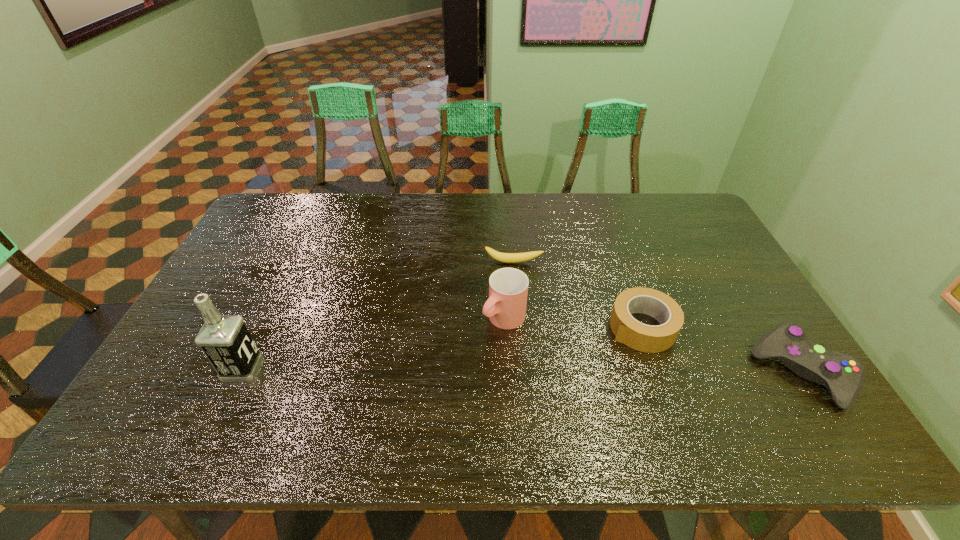
In order to click on object that is at the left edge in this screenshot , I will do `click(225, 340)`.

In order to click on object present at the right edge in this screenshot , I will do `click(843, 374)`.

You are a GUI agent. You are given a task and a screenshot of the screen. Output one action in this format:
    pyautogui.click(x=<x>, y=<y>)
    Task: Click on the object present at the near left corner
    
    Given the screenshot: What is the action you would take?
    pos(225,340)

Image resolution: width=960 pixels, height=540 pixels. Identify the location of object present at the near right corner. (843, 374).

This screenshot has height=540, width=960. Find the location of `free region at the far edge`. free region at the far edge is located at coordinates (528, 217).

Find the location of a particular element. The width and height of the screenshot is (960, 540). vacant area at the near edge of the desktop is located at coordinates click(499, 397).

Image resolution: width=960 pixels, height=540 pixels. Find the location of `vacant area at the left edge`. vacant area at the left edge is located at coordinates (235, 294).

Find the location of a particular element. free spot at the right edge of the desktop is located at coordinates (748, 322).

Locate an element on the screen. free region at the far right corner of the desktop is located at coordinates (658, 198).

The image size is (960, 540). I want to click on free space that is in between the farthest object and the duct tape, so click(578, 295).